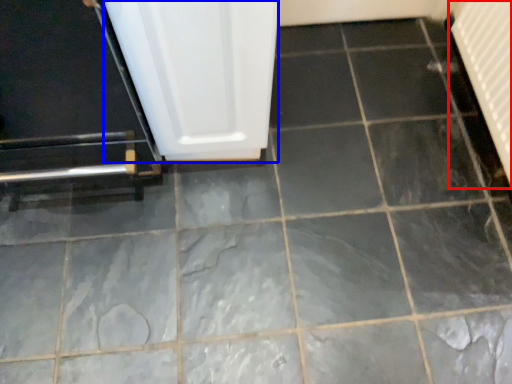
Question: Which object appears farthest to the camera in this image, radiator (highlighted by a red box) or screen door (highlighted by a blue box)?

Choices:
 (A) radiator
 (B) screen door

Answer: (A)